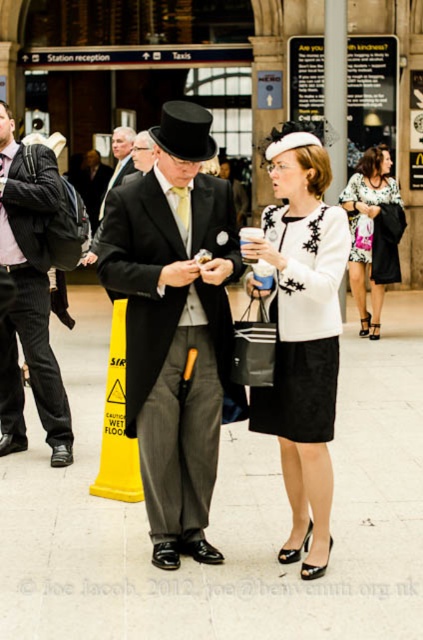
You are a photographer at the station and want to take a photo of both the shiny black suit at center and the pinstriped fabric suit at left. Which suit will appear larger in the photo?

The pinstriped fabric suit at left will appear larger in the photo because it is positioned above the shiny black suit at center, making it closer to the camera.

You are a fashion designer observing a runway show and notice two items at center stage, the black textured dress at center and the matte black coat at center. Given that the runway is only 8 meters long, will the models wearing these two items be able to walk the entire length of the runway without overlapping?

The black textured dress at center and the matte black coat at center are 7.60 meters apart. Since the runway is 8 meters long, they can walk the entire length without overlapping as the distance between them allows for movement within the runway length.